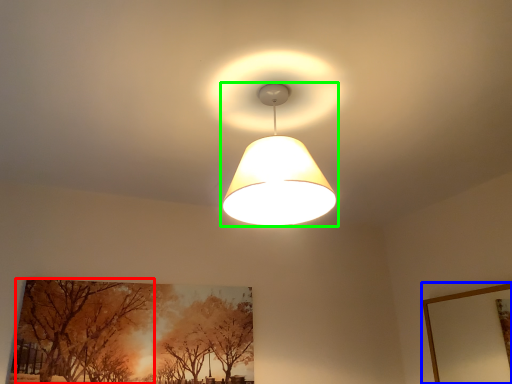
Question: Which object is the farthest from tree (highlighted by a red box)? Choose among these: picture frame (highlighted by a blue box) or lamp (highlighted by a green box).

Choices:
 (A) picture frame
 (B) lamp

Answer: (A)